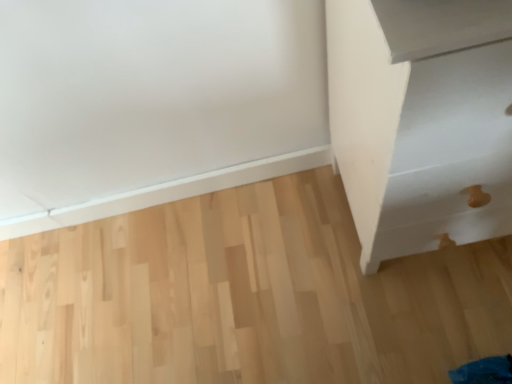
Describe the element at coordinates (245, 296) in the screenshot. I see `natural wood floor at center` at that location.

Locate an element on the screen. natural wood floor at center is located at coordinates (245, 296).

Find the location of `white matte drawer at right`. white matte drawer at right is located at coordinates (421, 120).

Describe the element at coordinates (421, 120) in the screenshot. The height and width of the screenshot is (384, 512). I see `white matte drawer at right` at that location.

This screenshot has height=384, width=512. What are the coordinates of `natural wood floor at center` in the screenshot? It's located at (245, 296).

Considering the relative positions of natural wood floor at center and white matte drawer at right in the image provided, is natural wood floor at center to the right of white matte drawer at right from the viewer's perspective?

Incorrect, natural wood floor at center is not on the right side of white matte drawer at right.

In the image, is natural wood floor at center positioned in front of or behind white matte drawer at right?

natural wood floor at center is behind white matte drawer at right.

Is point (319, 200) closer or farther from the camera than point (385, 185)?

Clearly, point (319, 200) is more distant from the camera than point (385, 185).

From the image's perspective, which is below, natural wood floor at center or white matte drawer at right?

natural wood floor at center is shown below in the image.

From a real-world perspective, which is physically below, natural wood floor at center or white matte drawer at right?

natural wood floor at center, from a real-world perspective.

Does natural wood floor at center have a lesser width compared to white matte drawer at right?

No.

Does natural wood floor at center have a greater height compared to white matte drawer at right?

Incorrect, the height of natural wood floor at center is not larger of that of white matte drawer at right.

Is natural wood floor at center bigger or smaller than white matte drawer at right?

Considering their sizes, natural wood floor at center takes up less space than white matte drawer at right.

Is natural wood floor at center outside of white matte drawer at right?

Yes.

Are natural wood floor at center and white matte drawer at right beside each other?

natural wood floor at center and white matte drawer at right are clearly separated.

Is natural wood floor at center turned away from white matte drawer at right?

No, natural wood floor at center is not facing the opposite direction of white matte drawer at right.

How different are the orientations of natural wood floor at center and white matte drawer at right in degrees?

There is a 180-degree angle between the facing directions of natural wood floor at center and white matte drawer at right.

Locate an element on the screen. Image resolution: width=512 pixels, height=384 pixels. plywood behind the white matte drawer at right is located at coordinates (245, 296).

Which object is positioned more to the right, white matte drawer at right or natural wood floor at center?

white matte drawer at right is more to the right.

Is white matte drawer at right further to camera compared to natural wood floor at center?

No, it is not.

Is point (497, 168) positioned behind point (228, 268)?

No, it is in front of (228, 268).

From the image's perspective, which object appears higher, white matte drawer at right or natural wood floor at center?

white matte drawer at right, from the image's perspective.

From a real-world perspective, is white matte drawer at right physically below natural wood floor at center?

No, from a real-world perspective, white matte drawer at right is not beneath natural wood floor at center.

Can you confirm if white matte drawer at right is thinner than natural wood floor at center?

Yes, white matte drawer at right is thinner than natural wood floor at center.

Who is taller, white matte drawer at right or natural wood floor at center?

white matte drawer at right is taller.

From the picture: Can you confirm if white matte drawer at right is smaller than natural wood floor at center?

No, white matte drawer at right is not smaller than natural wood floor at center.

Is white matte drawer at right situated inside natural wood floor at center or outside?

white matte drawer at right lies outside natural wood floor at center.

Based on the photo, is white matte drawer at right next to natural wood floor at center?

No, white matte drawer at right is not touching natural wood floor at center.

Is white matte drawer at right turned away from natural wood floor at center?

No.

Where is `plywood behind the white matte drawer at right`? plywood behind the white matte drawer at right is located at coordinates (245, 296).

In the image, there is a white matte drawer at right. Where is `plywood below it (from the image's perspective)`? This screenshot has height=384, width=512. plywood below it (from the image's perspective) is located at coordinates (245, 296).

This screenshot has height=384, width=512. I want to click on furniture in front of the natural wood floor at center, so (421, 120).